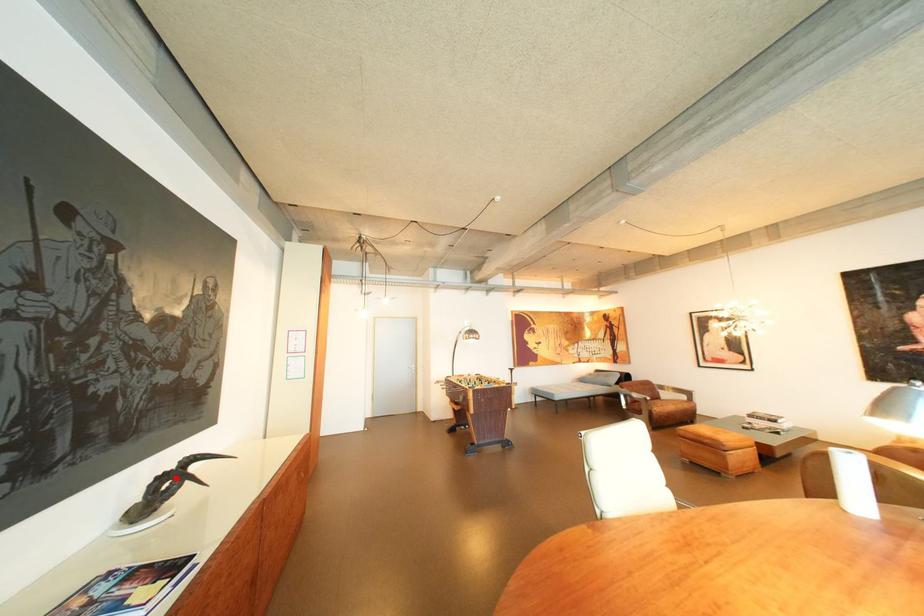
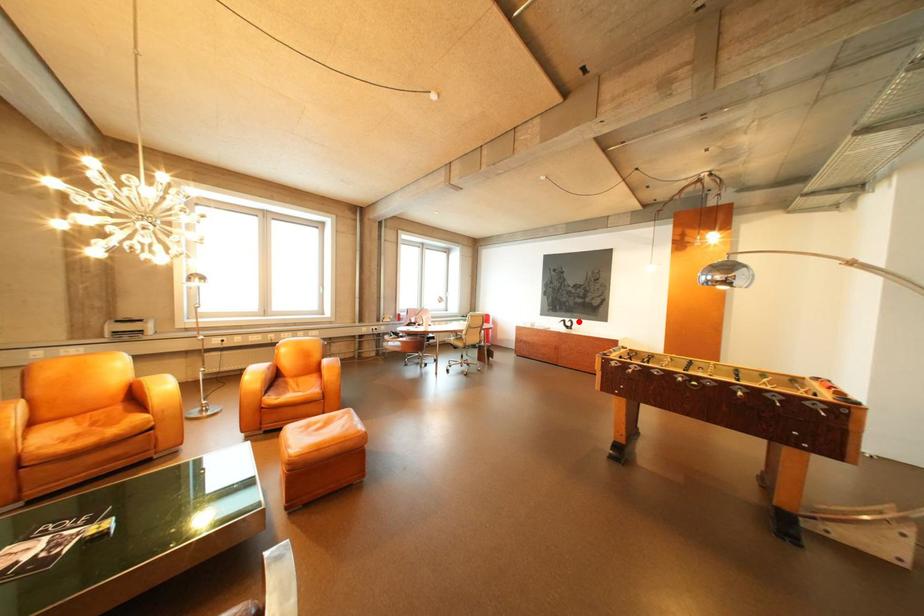
I am providing you with two images of the same scene from different viewpoints. A red point is marked on the first image and another point is marked on the second image. Does the point marked in image1 correspond to the same location as the one in image2?

Yes